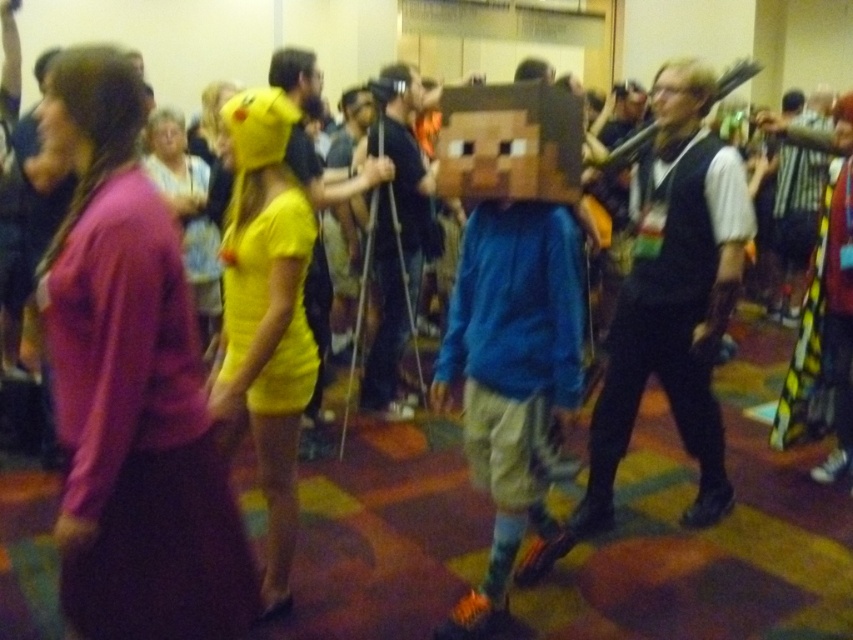
Question: Does matte black vest at center appear on the left side of wooden block at center?

Choices:
 (A) yes
 (B) no

Answer: (B)

Question: Among these points, which one is nearest to the camera?

Choices:
 (A) (672, 385)
 (B) (233, 600)

Answer: (B)

Question: Does purple matte sweater at left appear on the right side of wooden block at center?

Choices:
 (A) yes
 (B) no

Answer: (B)

Question: Where is purple matte sweater at left located in relation to wooden block at center in the image?

Choices:
 (A) below
 (B) above

Answer: (A)

Question: Which object is positioned closest to the matte black vest at center?

Choices:
 (A) wooden block at center
 (B) purple matte sweater at left

Answer: (A)

Question: Which object appears farthest from the camera in this image?

Choices:
 (A) wooden block at center
 (B) purple matte sweater at left

Answer: (A)